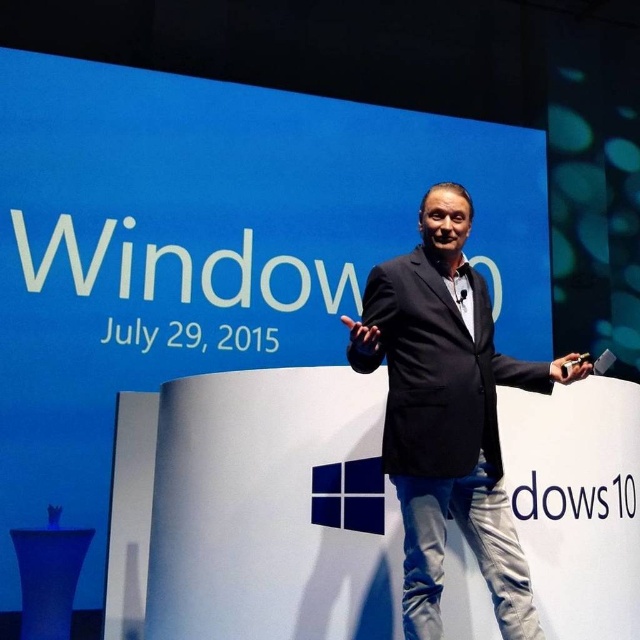
Question: Which of the following is the farthest from the observer?

Choices:
 (A) matte black remote at center
 (B) black matte suit at center

Answer: (A)

Question: Is black matte suit at center bigger than matte black remote at center?

Choices:
 (A) no
 (B) yes

Answer: (B)

Question: Which point is farther from the camera taking this photo?

Choices:
 (A) (356, 333)
 (B) (586, 369)

Answer: (B)

Question: Does black matte suit at center have a larger size compared to black matte hand at center?

Choices:
 (A) no
 (B) yes

Answer: (B)

Question: Which of the following is the closest to the observer?

Choices:
 (A) black matte suit at center
 (B) matte black remote at center
 (C) black matte hand at center

Answer: (C)

Question: Can you confirm if matte black remote at center is positioned above black matte hand at center?

Choices:
 (A) yes
 (B) no

Answer: (B)